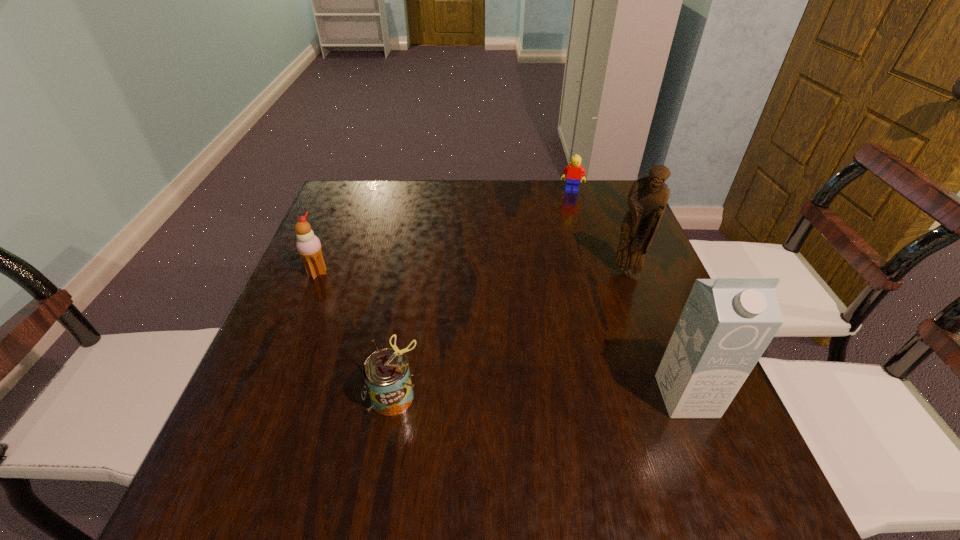
Locate an element on the screen. Image resolution: width=960 pixels, height=540 pixels. free space at the far left corner is located at coordinates (374, 184).

You are a GUI agent. You are given a task and a screenshot of the screen. Output one action in this format:
    pyautogui.click(x=<x>, y=<y>)
    Task: Click on the vacant region at the near left corner of the desktop
    Image resolution: width=960 pixels, height=540 pixels.
    Given the screenshot: What is the action you would take?
    pyautogui.click(x=246, y=442)

The width and height of the screenshot is (960, 540). In order to click on unoccupied area between the third object from left to right and the second shortest object in this screenshot , I will do `click(483, 293)`.

At what (x,y) coordinates should I click in order to perform the action: click on free space between the figurine and the leftmost object. Please return your answer as a coordinate pair (x, y). The height and width of the screenshot is (540, 960). Looking at the image, I should click on (472, 274).

Where is `free space between the leftmost object and the third object from left to right`? This screenshot has width=960, height=540. free space between the leftmost object and the third object from left to right is located at coordinates (444, 232).

Find the location of `empty space that is in between the fourth tallest object and the icecream`. empty space that is in between the fourth tallest object and the icecream is located at coordinates (356, 334).

The height and width of the screenshot is (540, 960). What are the coordinates of `blank region between the leftmost object and the farthest object` in the screenshot? It's located at pos(444,232).

This screenshot has height=540, width=960. What are the coordinates of `free space between the figurine and the leftmost object` in the screenshot? It's located at coord(472,274).

This screenshot has width=960, height=540. In order to click on free space that is in between the carton and the leftmost object in this screenshot , I will do `click(502, 335)`.

Identify the location of unoccupied area between the can and the carton. Image resolution: width=960 pixels, height=540 pixels. (540, 396).